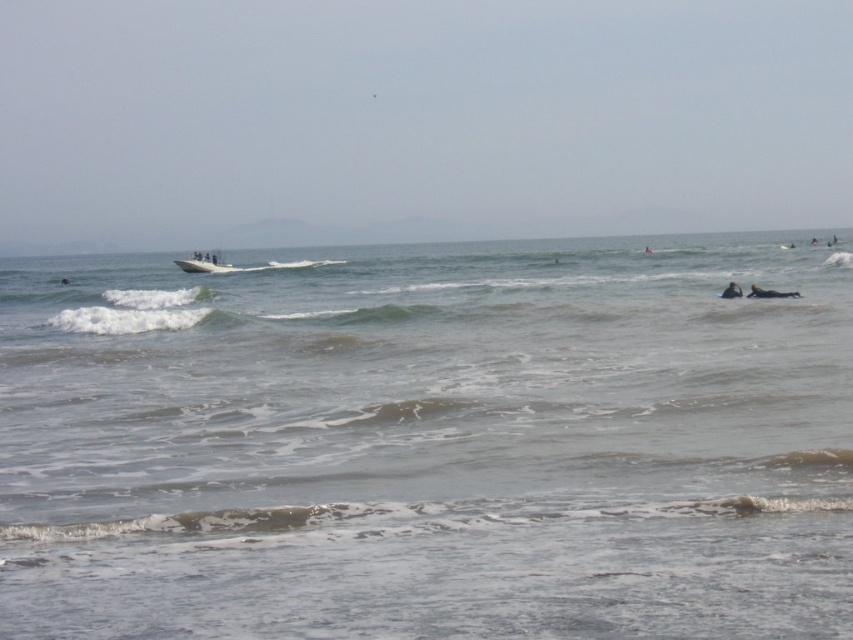
Question: Among these points, which one is nearest to the camera?

Choices:
 (A) (770, 296)
 (B) (722, 291)

Answer: (A)

Question: Is gray matte water at center further to camera compared to white plastic surfboard at center?

Choices:
 (A) no
 (B) yes

Answer: (A)

Question: Estimate the real-world distances between objects in this image. Which object is farther from the black rubber surfboard at lower right?

Choices:
 (A) white plastic surfboard at center
 (B) black wetsuit at lower right

Answer: (A)

Question: Considering the real-world distances, which object is farthest from the gray matte water at center?

Choices:
 (A) black wetsuit at lower right
 (B) black rubber surfboard at lower right
 (C) white plastic surfboard at center

Answer: (A)

Question: Does black rubber surfboard at lower right come in front of black wetsuit at lower right?

Choices:
 (A) yes
 (B) no

Answer: (A)

Question: Is white plastic surfboard at center positioned before black rubber surfboard at lower right?

Choices:
 (A) no
 (B) yes

Answer: (A)